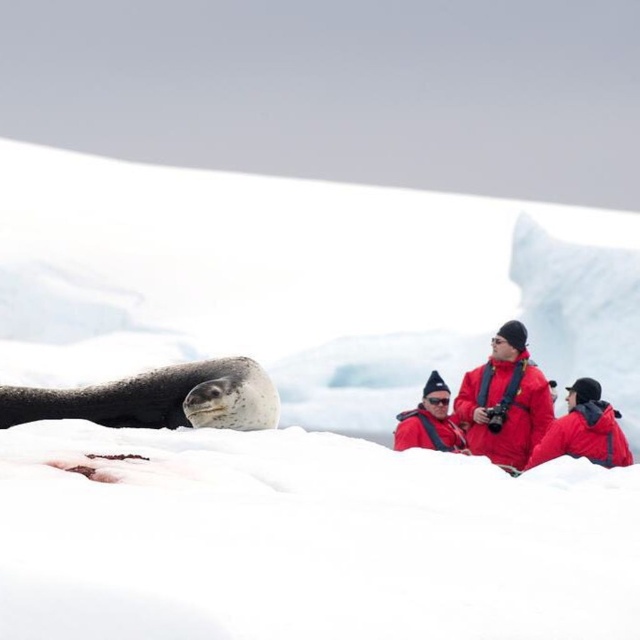
You are a photographer trying to capture a closeup of the seal. You have two jackets in view, the red matte jacket at center and the matte red jacket at center. Which jacket should you move closer to the seal to ensure it doesn t block your shot?

The red matte jacket at center is larger in size than the matte red jacket at center, so moving the smaller matte red jacket at center closer to the seal would block the shot less compared to the larger one. However, both jackets are at the same center position, so moving either might not be ideal. Please clarify the exact positions.

You are a wildlife photographer standing at the point marked by the coordinates [157,397] in the image. You want to take a photo of the seal without disturbing it. Which direction should you move to get closer to the seal?

The point marked by the coordinates [157,397] is on the speckled fur seal at lower left, so you are already at the seal. Therefore, you don not need to move any further to get closer to the seal.